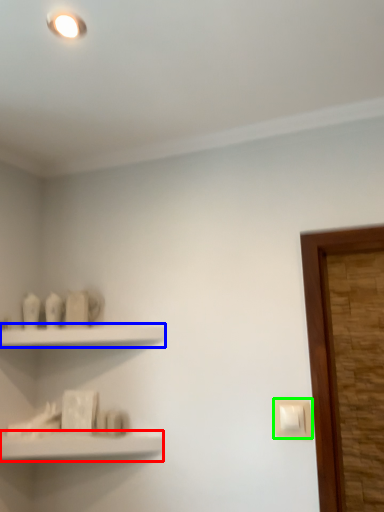
Question: Considering the real-world distances, which object is closest to shelf (highlighted by a red box)? shelf (highlighted by a blue box) or light switch (highlighted by a green box).

Choices:
 (A) shelf
 (B) light switch

Answer: (A)